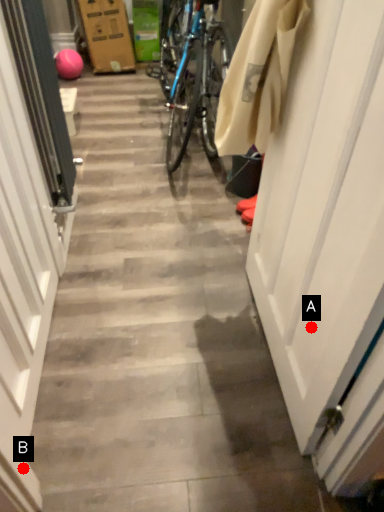
Question: Two points are circled on the image, labeled by A and B beside each circle. Which point appears closest to the camera in this image?

Choices:
 (A) A is closer
 (B) B is closer

Answer: (B)